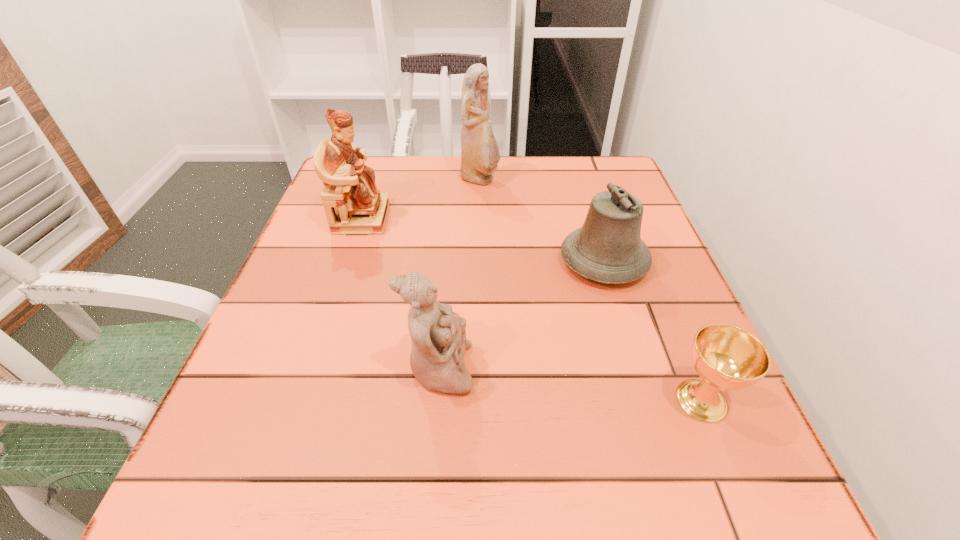
At what (x,y) coordinates should I click in order to perform the action: click on free space that satisfies the following two spatial constraints: 1. on the front-facing side of the farthest figurine; 2. on the left side of the chalice. Please return your answer as a coordinate pair (x, y). The image size is (960, 540). Looking at the image, I should click on (480, 400).

This screenshot has height=540, width=960. I want to click on vacant space that satisfies the following two spatial constraints: 1. on the front-facing side of the second farthest figurine; 2. on the back side of the second shortest object, so click(348, 261).